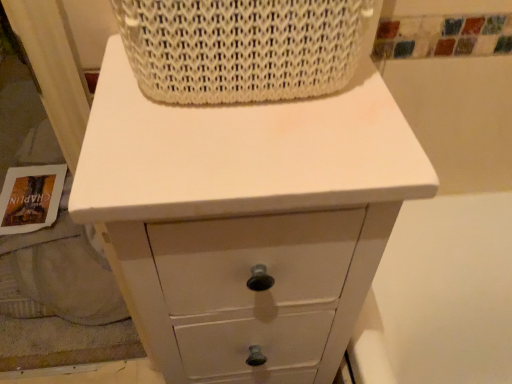
Question: Can you see white matte chest of drawers at center touching white woven basket at upper center?

Choices:
 (A) yes
 (B) no

Answer: (B)

Question: Is white matte chest of drawers at center not within white woven basket at upper center?

Choices:
 (A) no
 (B) yes

Answer: (B)

Question: Is white matte chest of drawers at center oriented towards white woven basket at upper center?

Choices:
 (A) yes
 (B) no

Answer: (B)

Question: Does white matte chest of drawers at center come in front of white woven basket at upper center?

Choices:
 (A) no
 (B) yes

Answer: (A)

Question: Can you confirm if white matte chest of drawers at center is shorter than white woven basket at upper center?

Choices:
 (A) no
 (B) yes

Answer: (A)

Question: Can you confirm if white matte chest of drawers at center is taller than white woven basket at upper center?

Choices:
 (A) no
 (B) yes

Answer: (B)

Question: Is white woven basket at upper center shorter than white matte chest of drawers at center?

Choices:
 (A) no
 (B) yes

Answer: (B)

Question: Considering the relative positions of white woven basket at upper center and white matte chest of drawers at center in the image provided, is white woven basket at upper center to the left of white matte chest of drawers at center from the viewer's perspective?

Choices:
 (A) no
 (B) yes

Answer: (A)

Question: Does white woven basket at upper center come behind white matte chest of drawers at center?

Choices:
 (A) yes
 (B) no

Answer: (B)

Question: From a real-world perspective, is white woven basket at upper center positioned under white matte chest of drawers at center based on gravity?

Choices:
 (A) yes
 (B) no

Answer: (B)

Question: Considering the relative sizes of white woven basket at upper center and white matte chest of drawers at center in the image provided, is white woven basket at upper center smaller than white matte chest of drawers at center?

Choices:
 (A) no
 (B) yes

Answer: (B)

Question: Is white woven basket at upper center to the right of white matte chest of drawers at center from the viewer's perspective?

Choices:
 (A) no
 (B) yes

Answer: (B)

Question: From a real-world perspective, is white woven basket at upper center above or below white matte chest of drawers at center?

Choices:
 (A) below
 (B) above

Answer: (B)